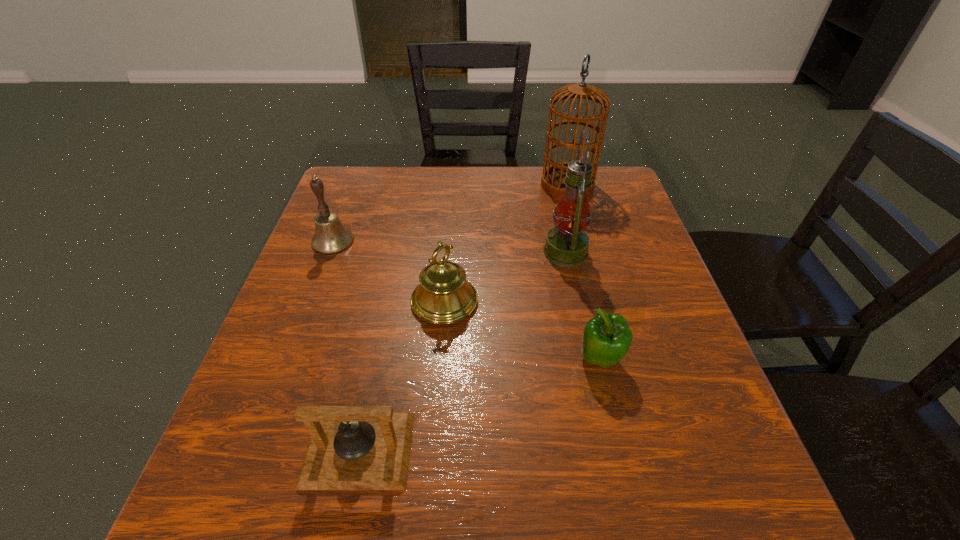
At what (x,y) coordinates should I click in order to perform the action: click on bell pepper at the right edge. Please return your answer as a coordinate pair (x, y). The width and height of the screenshot is (960, 540). Looking at the image, I should click on pyautogui.click(x=607, y=337).

The width and height of the screenshot is (960, 540). I want to click on object situated at the near left corner, so click(351, 447).

Locate an element on the screen. object that is at the far right corner is located at coordinates (552, 181).

Find the location of a particular element. free region at the far edge of the desktop is located at coordinates (527, 188).

You are a GUI agent. You are given a task and a screenshot of the screen. Output one action in this format:
    pyautogui.click(x=<x>, y=<y>)
    Task: Click on the vacant position at the near edge of the desktop
    Image resolution: width=960 pixels, height=540 pixels.
    Given the screenshot: What is the action you would take?
    pyautogui.click(x=424, y=505)

Image resolution: width=960 pixels, height=540 pixels. I want to click on vacant region at the left edge, so click(x=240, y=403).

Image resolution: width=960 pixels, height=540 pixels. In order to click on vacant region at the right edge of the desktop in this screenshot , I will do `click(692, 392)`.

I want to click on vacant space at the far right corner of the desktop, so click(x=617, y=184).

In order to click on vacant space at the near right corner in this screenshot , I will do `click(742, 495)`.

Where is `vacant point located between the third nearest object and the bell pepper`? vacant point located between the third nearest object and the bell pepper is located at coordinates (522, 330).